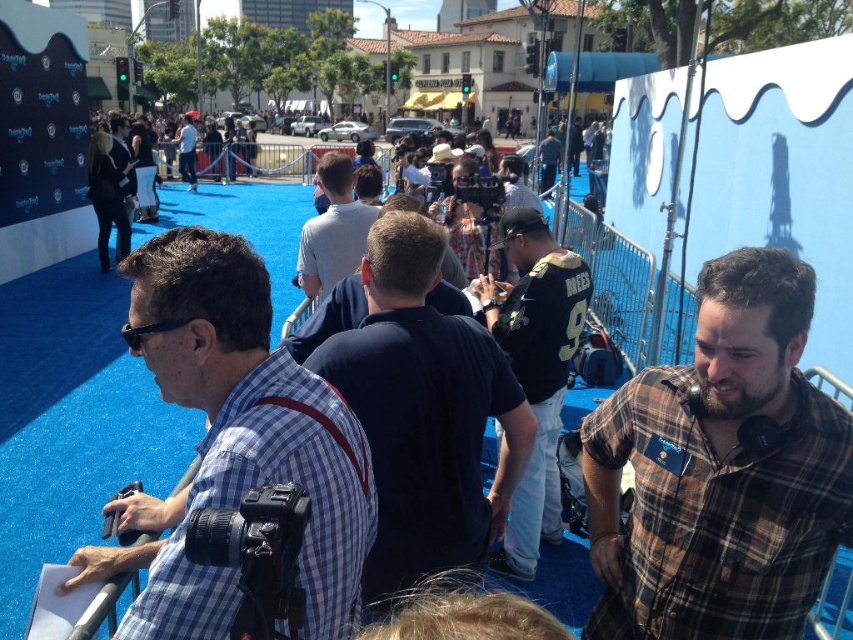
You are a photographer at the event and need to capture a clear shot of both the brown plaid shirt at center and the light gray shirt at center. Since you want both subjects to be fully visible, which shirt should you focus on first to ensure the taller one is in frame?

The brown plaid shirt at center is taller than the light gray shirt at center, so you should focus on the brown plaid shirt at center first to ensure the taller subject is properly framed before adjusting for the shorter one.

You are standing at the point marked as point (234, 442) in the scene. What is the nearest object to you?

The nearest object to you at point (234, 442) is the blue plaid shirt at center.